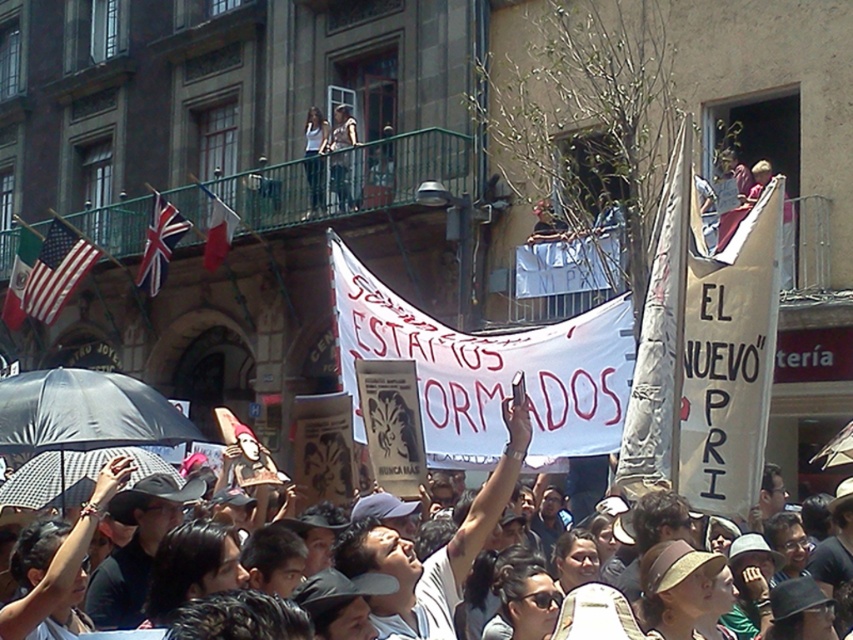
Is point (68, 273) closer to viewer compared to point (206, 236)?

No.

Who is positioned more to the left, american flag at left or red fabric flag at upper left?

american flag at left

You are a GUI agent. You are given a task and a screenshot of the screen. Output one action in this format:
    pyautogui.click(x=<x>, y=<y>)
    Task: Click on the american flag at left
    
    Given the screenshot: What is the action you would take?
    pyautogui.click(x=56, y=272)

You are a GUI agent. You are given a task and a screenshot of the screen. Output one action in this format:
    pyautogui.click(x=<x>, y=<y>)
    Task: Click on the american flag at left
    
    Given the screenshot: What is the action you would take?
    pyautogui.click(x=56, y=272)

Is white paper banner at center positioned before union jack fabric at upper left?

Yes, white paper banner at center is in front of union jack fabric at upper left.

Who is more forward, (495, 472) or (171, 234)?

Point (495, 472) is in front.

Find the location of a particular element. The height and width of the screenshot is (640, 853). white paper banner at center is located at coordinates (64, 557).

Does union jack fabric at upper left have a smaller size compared to white shirt at upper center?

No.

Which is more to the left, union jack fabric at upper left or white shirt at upper center?

Positioned to the left is union jack fabric at upper left.

Between point (155, 262) and point (318, 189), which one is positioned behind?

Point (155, 262)

Locate an element on the screen. This screenshot has height=640, width=853. union jack fabric at upper left is located at coordinates (160, 243).